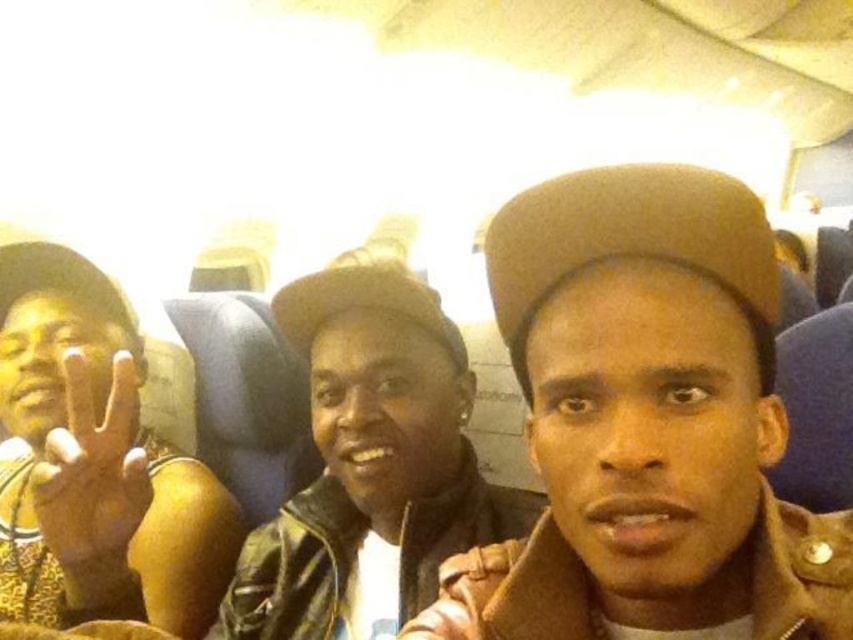
The width and height of the screenshot is (853, 640). Describe the element at coordinates (646, 424) in the screenshot. I see `brown leather jacket at center` at that location.

Is brown leather jacket at center further to camera compared to yellow printed shirt at left?

No, it is in front of yellow printed shirt at left.

Does point (734, 564) come in front of point (165, 458)?

Yes, it is in front of point (165, 458).

Locate an element on the screen. brown leather jacket at center is located at coordinates (646, 424).

Can you confirm if yellow printed shirt at left is positioned below yellow matte hand at left?

Correct, yellow printed shirt at left is located below yellow matte hand at left.

Where is `yellow printed shirt at left`? This screenshot has height=640, width=853. yellow printed shirt at left is located at coordinates (96, 464).

Does brown leather jacket at center have a greater height compared to yellow matte hand at left?

Yes.

Between brown leather jacket at center and yellow matte hand at left, which one is positioned lower?

yellow matte hand at left

Locate an element on the screen. This screenshot has width=853, height=640. brown leather jacket at center is located at coordinates (646, 424).